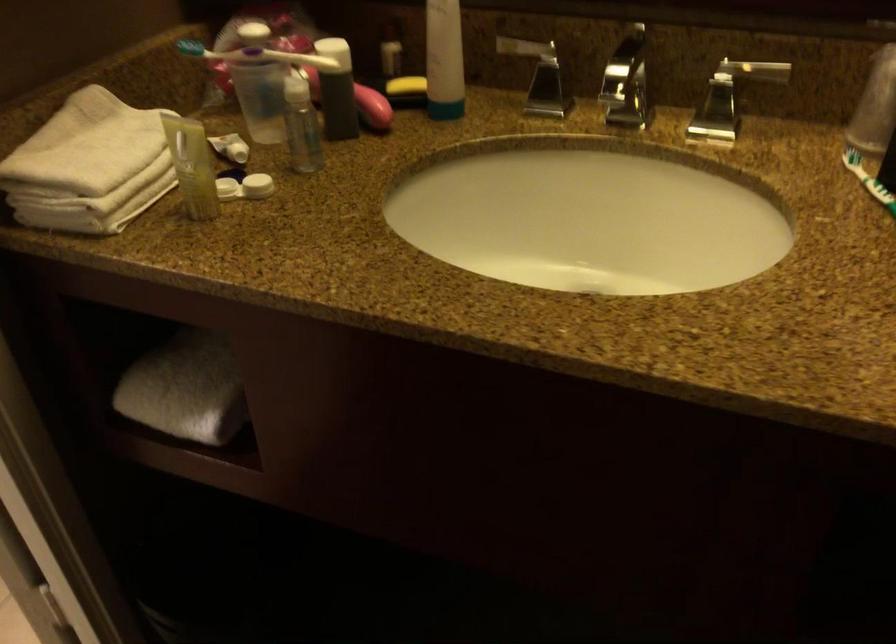
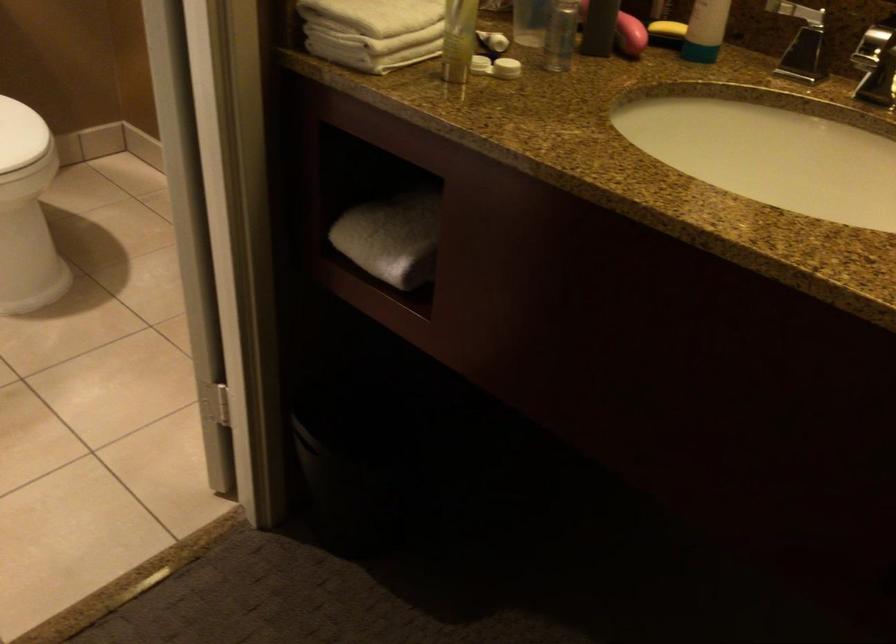
Question: Based on the continuous images, in which direction is the camera rotating? Reply with the corresponding letter.

Choices:
 (A) Left
 (B) Right
 (C) Up
 (D) Down

Answer: (A)